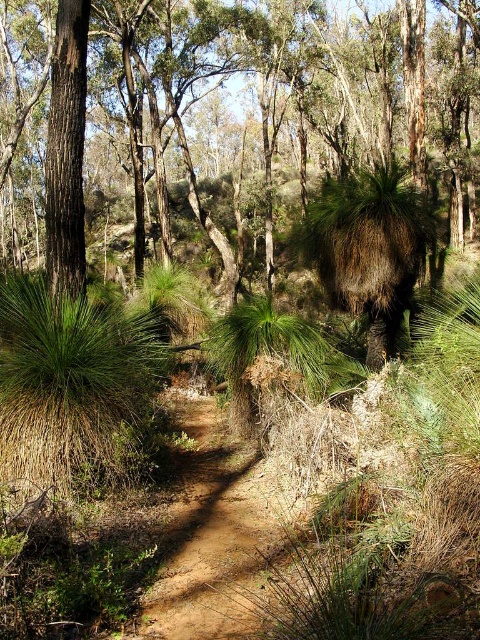
Question: Where is brown rough tree at center located in relation to smooth brown tree trunk at upper left in the image?

Choices:
 (A) below
 (B) above

Answer: (B)

Question: Is brown rough tree at center closer to camera compared to smooth brown tree trunk at upper left?

Choices:
 (A) yes
 (B) no

Answer: (B)

Question: Among these points, which one is farthest from the camera?

Choices:
 (A) (55, 54)
 (B) (57, 131)

Answer: (A)

Question: Considering the relative positions of brown rough tree at center and smooth brown tree trunk at upper left in the image provided, where is brown rough tree at center located with respect to smooth brown tree trunk at upper left?

Choices:
 (A) above
 (B) below

Answer: (A)